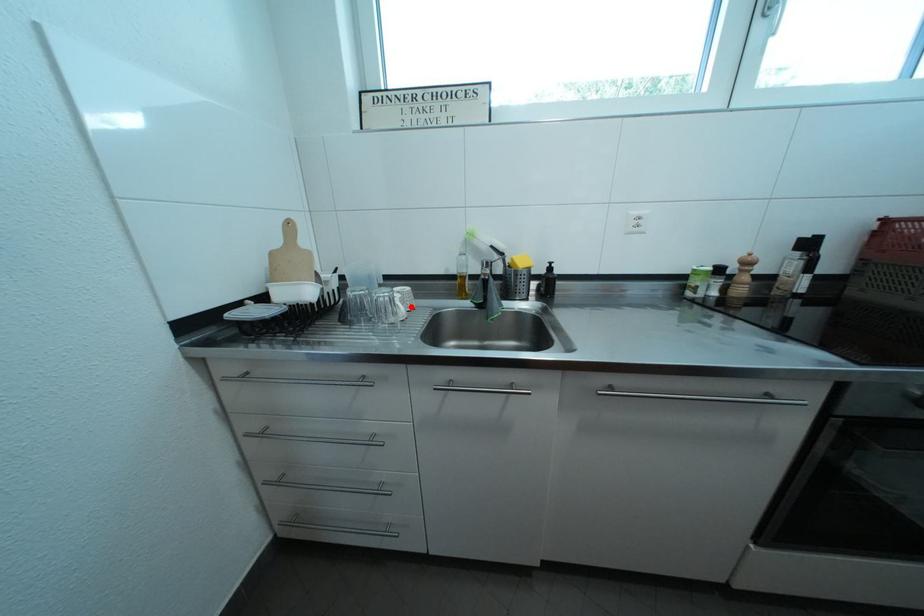
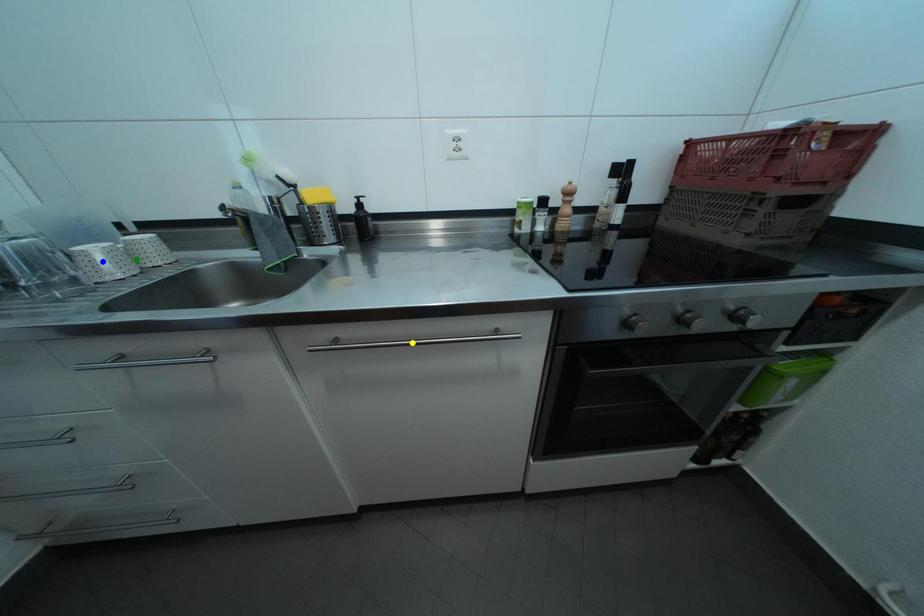
Question: I am providing you with two images of the same scene from different viewpoints. A red point is marked on the first image. You are given multiple points on the second image. Which point in image 2 is actually the same real-world point as the red point in image 1?

Choices:
 (A) yellow point
 (B) green point
 (C) blue point

Answer: (B)